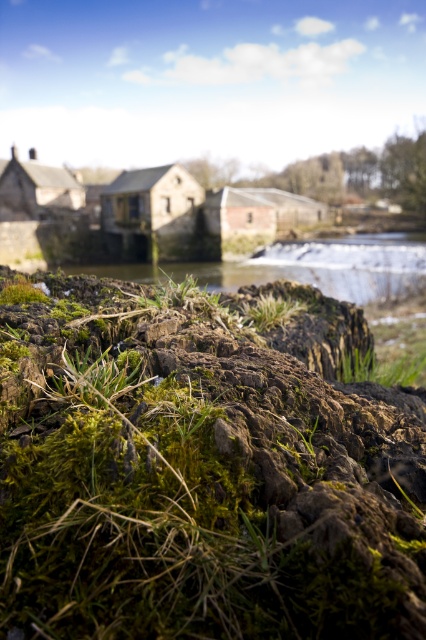
Can you confirm if green mossy rock at lower center is bigger than green mossy grass at center?

Correct, green mossy rock at lower center is larger in size than green mossy grass at center.

From the picture: Who is shorter, green mossy rock at lower center or green mossy grass at center?

Standing shorter between the two is green mossy grass at center.

Does point (250, 474) lie behind point (354, 368)?

No, (250, 474) is in front of (354, 368).

This screenshot has width=426, height=640. In order to click on green mossy rock at lower center in this screenshot , I will do `click(201, 470)`.